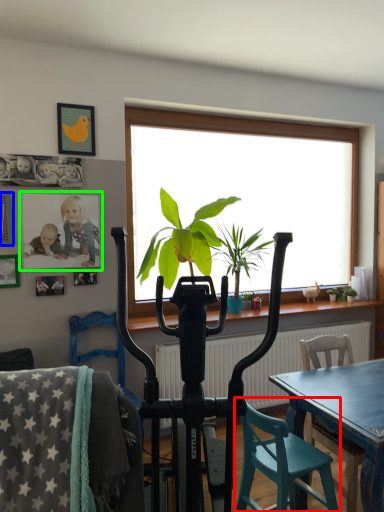
Question: Which is nearer to the chair (highlighted by a red box)? picture frame (highlighted by a blue box) or picture frame (highlighted by a green box).

Choices:
 (A) picture frame
 (B) picture frame

Answer: (B)